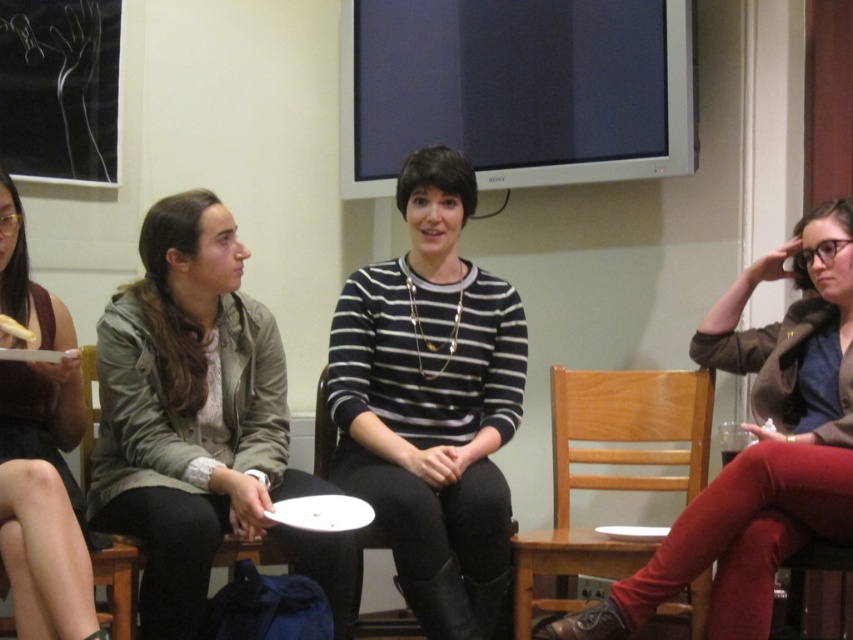
You are a photographer trying to capture a closeup of the velvet red pants at right and the matte black jacket at left. Based on their positions, which one would require you to move closer to the subject?

The velvet red pants at right is below matte black jacket at left, so you would need to move closer to the velvet red pants at right to capture a closeup since it is positioned lower.

Please look at the coordinates point at (199, 422). What object is located there?

The point at (199, 422) indicates the green matte jacket at center.

You are a photographer setting up a shoot in this room. You need to position a 1.8m tall backdrop behind the green matte jacket at center so it reaches from the floor to the top of their head. Can the backdrop accommodate the wooden chair at lower center if placed directly behind it?

The green matte jacket at center is much taller than the wooden chair at lower center. Since the backdrop is 1.8m tall and reaches the top of the jacket, it will also cover the entire height of the wooden chair at lower center, so yes, the backdrop can accommodate the wooden chair at lower center.